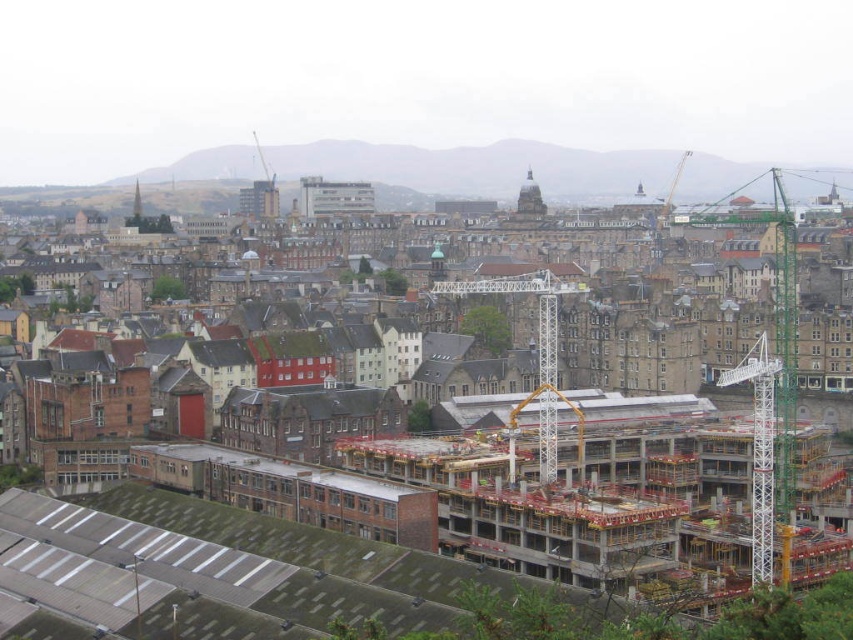
Question: Which of these objects is positioned closest to the white metallic crane at center?

Choices:
 (A) concrete construction site at center
 (B) white metallic crane at right

Answer: (A)

Question: Which point is closer to the camera?

Choices:
 (A) white metallic crane at right
 (B) white metallic crane at center
 (C) concrete construction site at center

Answer: (C)

Question: Does concrete construction site at center lie behind white metallic crane at center?

Choices:
 (A) no
 (B) yes

Answer: (A)

Question: Where is white metallic crane at center located in relation to white metallic crane at right in the image?

Choices:
 (A) left
 (B) right

Answer: (A)

Question: Which object appears closest to the camera in this image?

Choices:
 (A) white metallic crane at right
 (B) white metallic crane at center

Answer: (A)

Question: Does white metallic crane at center appear on the left side of white metallic crane at right?

Choices:
 (A) yes
 (B) no

Answer: (A)